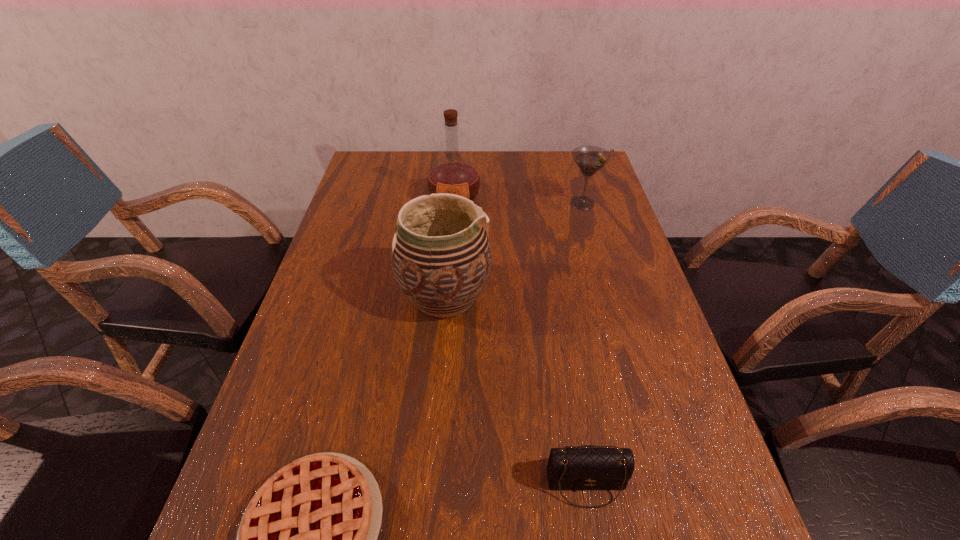
This screenshot has width=960, height=540. I want to click on object present at the right edge, so click(x=590, y=159).

The width and height of the screenshot is (960, 540). I want to click on free space at the far edge, so click(487, 154).

In the image, there is a desktop. What are the coordinates of `vacant region at the left edge` in the screenshot? It's located at (312, 381).

Where is `vacant space at the right edge of the desktop`? This screenshot has height=540, width=960. vacant space at the right edge of the desktop is located at coordinates (612, 330).

Locate an element on the screen. This screenshot has width=960, height=540. free spot between the liquor and the rightmost object is located at coordinates (518, 201).

Image resolution: width=960 pixels, height=540 pixels. Identify the location of unoccupied area between the martini and the liquor. (518, 201).

Image resolution: width=960 pixels, height=540 pixels. Find the location of `empty space between the third shortest object and the second object from right to left`. empty space between the third shortest object and the second object from right to left is located at coordinates (585, 343).

What are the coordinates of `free space between the liquor and the clutch bag` in the screenshot? It's located at (520, 342).

What are the coordinates of `empty space between the clutch bag and the third nearest object` in the screenshot? It's located at (516, 390).

At what (x,y) coordinates should I click in order to perform the action: click on object that stands as the second closest to the martini. Please return your answer as a coordinate pair (x, y). Image resolution: width=960 pixels, height=540 pixels. Looking at the image, I should click on (441, 257).